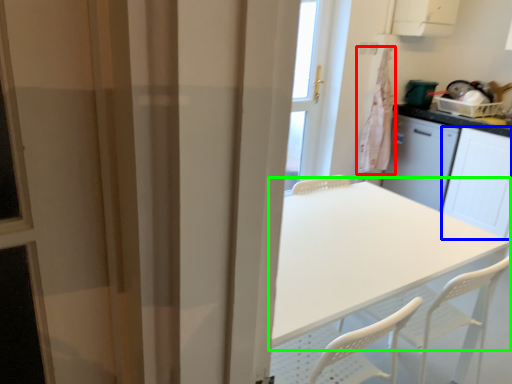
Question: Which is nearer to the laundry (highlighted by a red box)? screen door (highlighted by a blue box) or table (highlighted by a green box).

Choices:
 (A) screen door
 (B) table

Answer: (A)